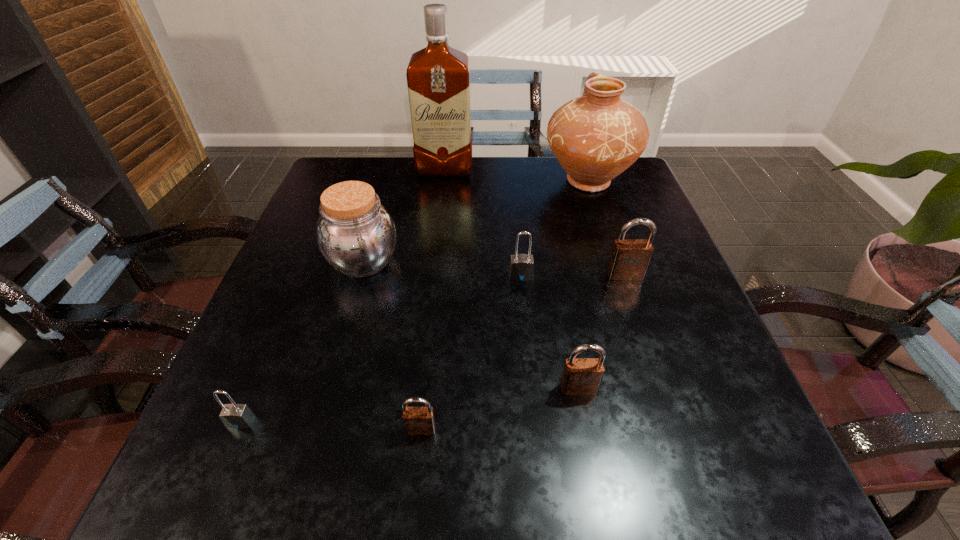
This screenshot has width=960, height=540. Identify the location of empty location between the pottery and the nearest brown padlock. (504, 305).

Locate an element on the screen. Image resolution: width=960 pixels, height=540 pixels. object that is the sixth closest one to the fourth padlock from right to left is located at coordinates (595, 137).

I want to click on the third closest object relative to the pottery, so click(521, 267).

Find the location of a particular element. padlock that is the second closest to the fourth tallest object is located at coordinates (581, 376).

This screenshot has height=540, width=960. I want to click on padlock that is the fourth closest one to the jar, so click(581, 376).

Select which brown padlock is the second closest to the fifth object from left to right. Please provide its 2D coordinates. Your answer should be formatted as a tuple, i.e. [(x, y)], where the tuple contains the x and y coordinates of a point satisfying the conditions above.

[(581, 376)]

You are a GUI agent. You are given a task and a screenshot of the screen. Output one action in this format:
    pyautogui.click(x=<x>, y=<y>)
    Task: Click on the closest brown padlock relative to the farthest brown padlock
    This screenshot has width=960, height=540.
    Given the screenshot: What is the action you would take?
    pyautogui.click(x=581, y=376)